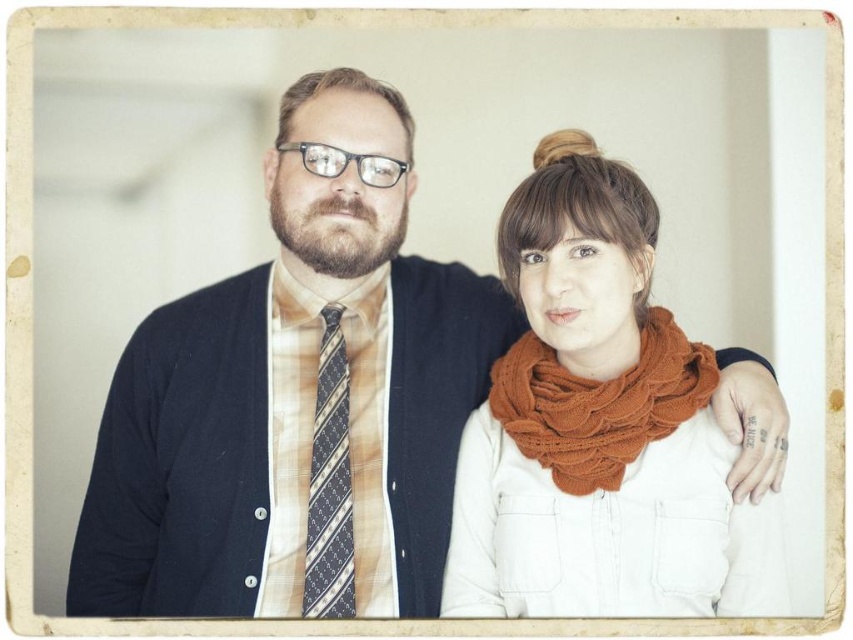
Between matte black sweater at left and knitted orange scarf at center, which one appears on the left side from the viewer's perspective?

From the viewer's perspective, matte black sweater at left appears more on the left side.

Measure the distance between point (303, 440) and camera.

1.56 meters

Is point (354, 136) in front of point (607, 413)?

No.

The height and width of the screenshot is (640, 853). I want to click on matte black sweater at left, so click(297, 397).

Does orange knitted scarf at center appear on the left side of blue striped tie at center?

In fact, orange knitted scarf at center is to the right of blue striped tie at center.

Does point (608, 513) lie behind point (314, 586)?

No, it is not.

You are a GUI agent. You are given a task and a screenshot of the screen. Output one action in this format:
    pyautogui.click(x=<x>, y=<y>)
    Task: Click on the orange knitted scarf at center
    This screenshot has width=853, height=640.
    Given the screenshot: What is the action you would take?
    pyautogui.click(x=599, y=428)

This screenshot has width=853, height=640. Describe the element at coordinates (599, 403) in the screenshot. I see `knitted orange scarf at center` at that location.

Between point (549, 428) and point (326, 570), which one is positioned behind?

The point (326, 570) is behind.

Locate an element on the screen. The image size is (853, 640). knitted orange scarf at center is located at coordinates (599, 403).